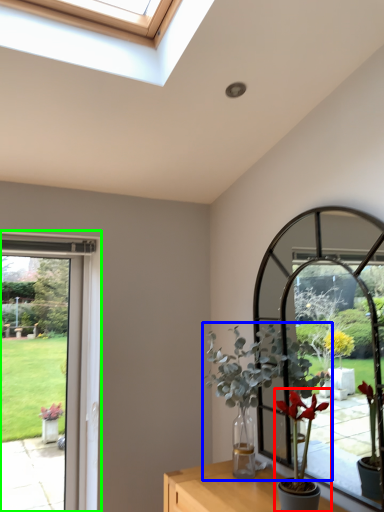
Question: Considering the real-world distances, which object is closest to houseplant (highlighted by a red box)? houseplant (highlighted by a blue box) or window frame (highlighted by a green box).

Choices:
 (A) houseplant
 (B) window frame

Answer: (A)